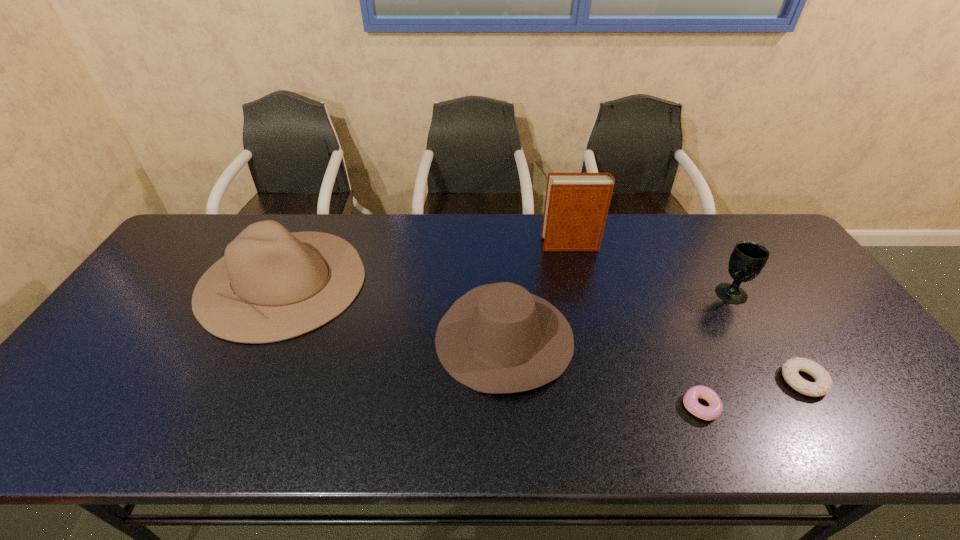
I want to click on the tallest object, so click(576, 205).

Locate an element on the screen. Image resolution: width=960 pixels, height=540 pixels. sombrero is located at coordinates (292, 283).

The image size is (960, 540). Find the location of `chalice`. chalice is located at coordinates (747, 259).

Identify the location of cowboy hat. This screenshot has height=540, width=960. (497, 338).

Where is `the right doughnut`? The image size is (960, 540). the right doughnut is located at coordinates (823, 384).

This screenshot has width=960, height=540. Find the location of `the third object from right to left`. the third object from right to left is located at coordinates (690, 400).

Locate an element on the screen. This screenshot has height=540, width=960. vacant space located on the open cover of the tallest object is located at coordinates (505, 245).

You are a GUI agent. You are given a task and a screenshot of the screen. Output one action in this format:
    pyautogui.click(x=<x>, y=<y>)
    Task: Click on the vacant space located 0.170m on the open cover of the tallest object
    Image resolution: width=960 pixels, height=540 pixels.
    Given the screenshot: What is the action you would take?
    pyautogui.click(x=490, y=245)

Find the location of a particular element. free space located 0.380m on the open cover of the tallest object is located at coordinates (424, 245).

Find the location of `free region located on the right of the sombrero`. free region located on the right of the sombrero is located at coordinates (483, 281).